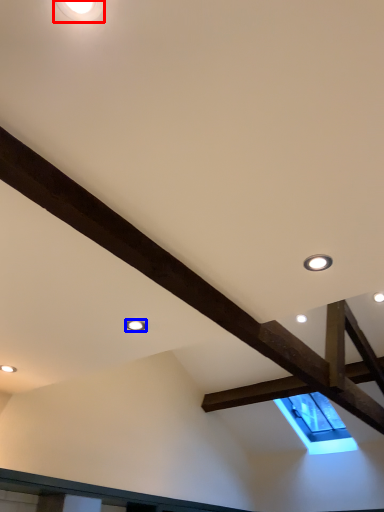
Question: Which of the following is the farthest to the observer, droplight (highlighted by a red box) or droplight (highlighted by a blue box)?

Choices:
 (A) droplight
 (B) droplight

Answer: (B)